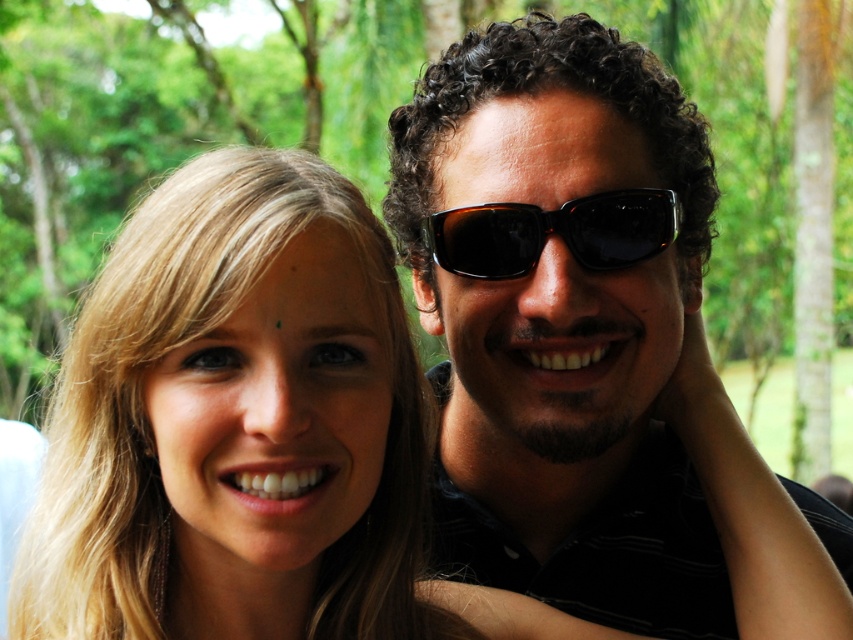
You are a photographer trying to capture a close detail shot of the two people in the scene. Since you want to focus on their facial features, you need to adjust your camera settings to ensure both the blonde hair at center and the black plastic sunglasses at center are in clear focus. Given their sizes, which object should you prioritize focusing on first to ensure sharpness?

The blonde hair at center is bigger than the black plastic sunglasses at center, so you should prioritize focusing on the blonde hair at center first to ensure its sharpness before adjusting for the smaller sunglasses.

You are a photographer trying to capture a clear shot of the blonde hair at center and the matte black sunglasses at center. Since the sunglasses are on the right side of the blonde hair, which object should you focus on first to ensure both are in frame?

→ You should focus on the blonde hair at center first because the matte black sunglasses at center is positioned on its right side, so starting with the hair ensures the sunglasses will be within the frame.

You are standing in a tropical garden and see two points marked in the image. The first point is at coordinates point (619,253) and the second is at point (641,236). Which point is nearer to you?

Point (619,253) is closer to the viewer than point (641,236).